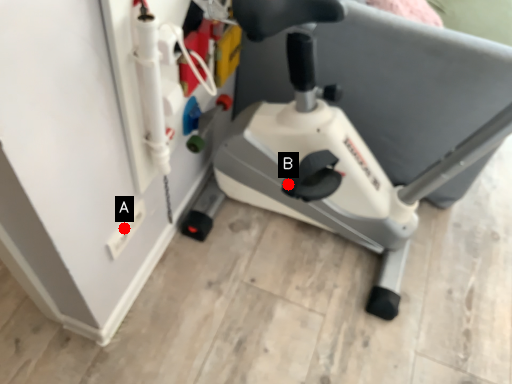
Question: Two points are circled on the image, labeled by A and B beside each circle. Which point is closer to the camera taking this photo?

Choices:
 (A) A is closer
 (B) B is closer

Answer: (A)